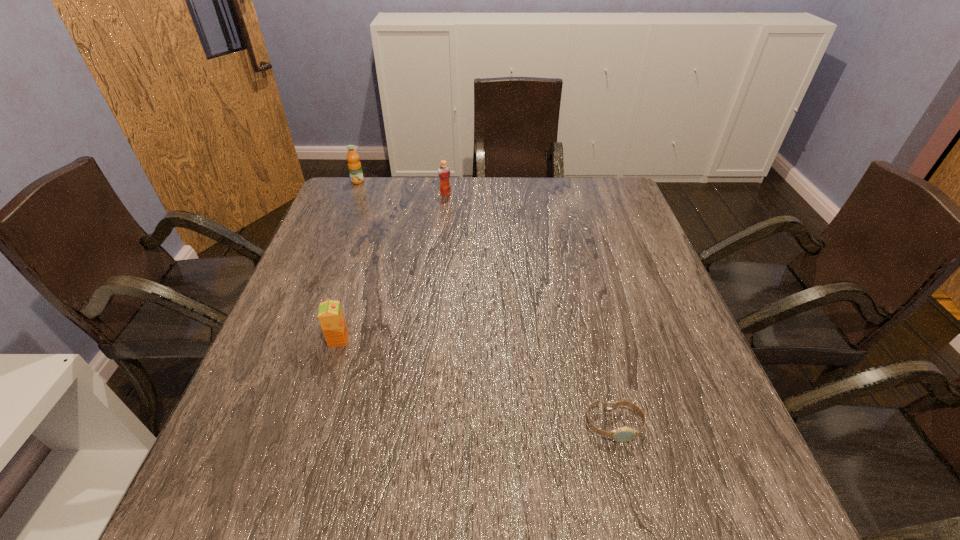
The image size is (960, 540). I want to click on the farthest orange juice, so click(x=355, y=170).

Identify the location of the leftmost object. (355, 170).

Image resolution: width=960 pixels, height=540 pixels. What are the coordinates of `the rightmost orange juice` in the screenshot? It's located at (443, 171).

The image size is (960, 540). What are the coordinates of `the second object from right to left` in the screenshot? It's located at (443, 171).

The width and height of the screenshot is (960, 540). Identify the location of the third farthest object. (330, 315).

The width and height of the screenshot is (960, 540). What are the coordinates of `the nearest orange juice` in the screenshot? It's located at (330, 315).

This screenshot has height=540, width=960. What are the coordinates of `the shortest object` in the screenshot? It's located at (623, 434).

Where is `the nearest object`? The image size is (960, 540). the nearest object is located at coordinates (623, 434).

Find the location of a particular element. blank area located on the label of the farthest object is located at coordinates (345, 214).

Where is `vacant region located on the right of the second nearest orange juice`? Image resolution: width=960 pixels, height=540 pixels. vacant region located on the right of the second nearest orange juice is located at coordinates (514, 194).